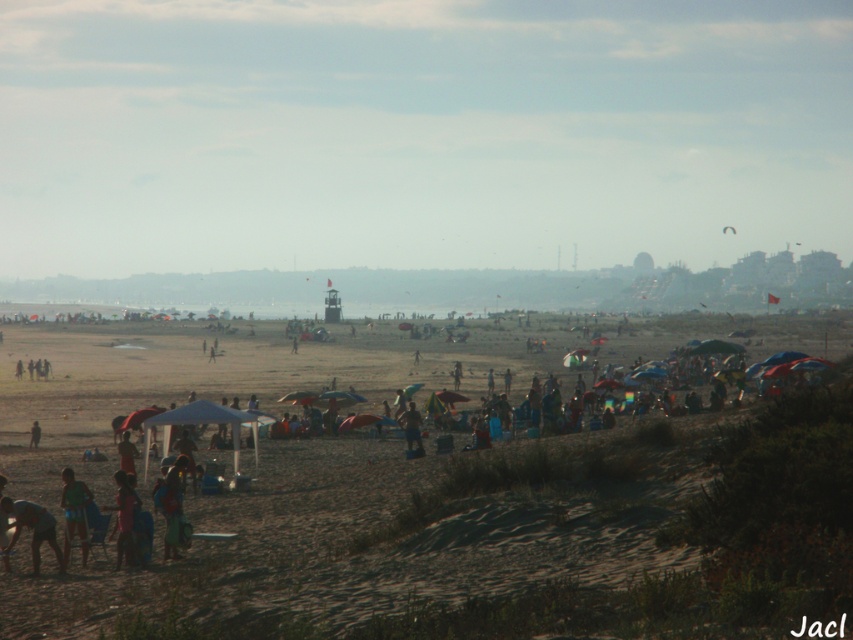
You are standing on the brown sandy beach at center and want to reach the light blue fabric umbrella at lower left. Which direction should you move to get closer to the umbrella?

Since the brown sandy beach at center is in front of the light blue fabric umbrella at lower left, you should move backward to reach the umbrella.

You are a photographer standing at the edge of the beach. You want to take a photo of the green fabric shorts at lower left and the light blue fabric umbrella at lower left. Which object will appear taller in the photo?

The light blue fabric umbrella at lower left will appear taller in the photo because the green fabric shorts at lower left has a lesser height compared to it.